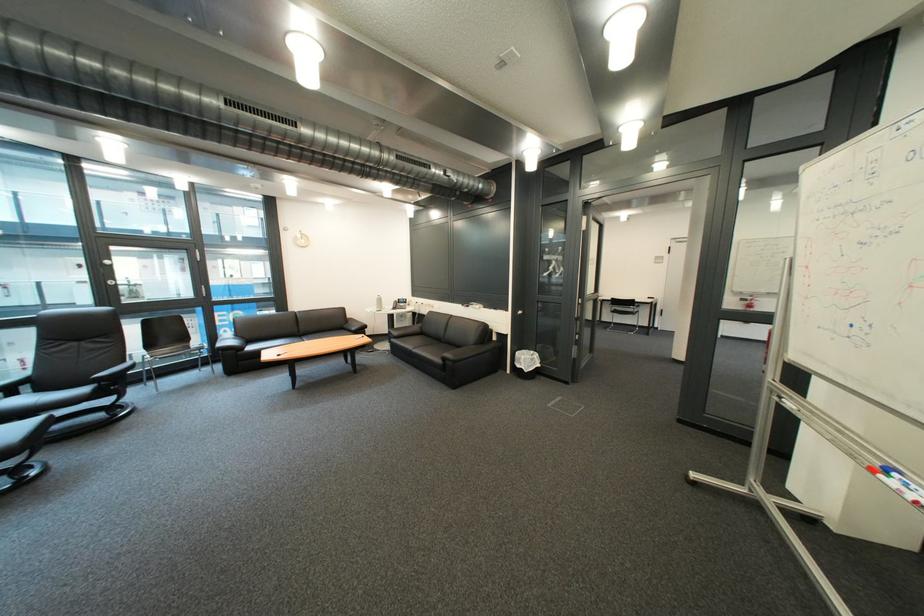
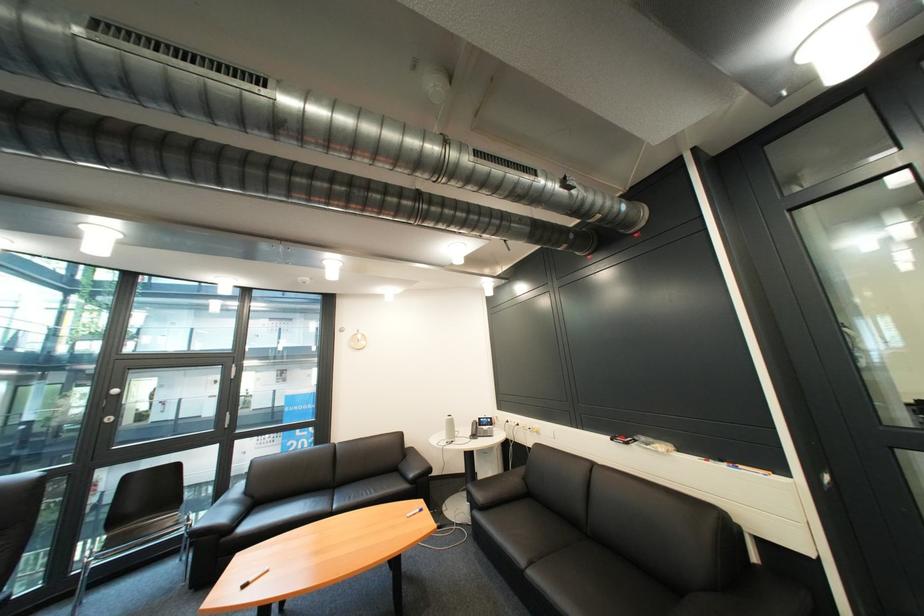
Where in the second image is the point corresponding to pixel 429 353 from the first image?

(546, 577)